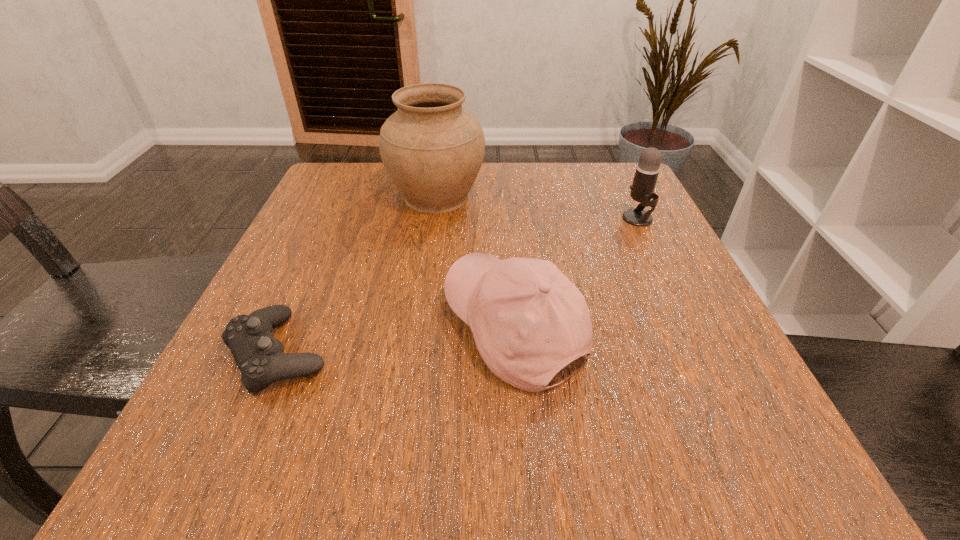
The width and height of the screenshot is (960, 540). What are the coordinates of `blank space that satisfies the following two spatial constraints: 1. on the front-facing side of the third tallest object; 2. on the front side of the shortest object` in the screenshot? It's located at (516, 353).